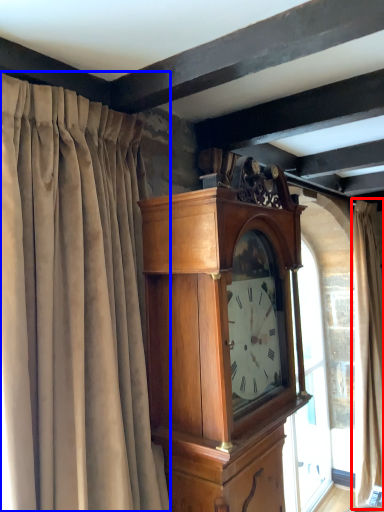
Question: Which object is further to the camera taking this photo, curtain (highlighted by a red box) or curtain (highlighted by a blue box)?

Choices:
 (A) curtain
 (B) curtain

Answer: (A)